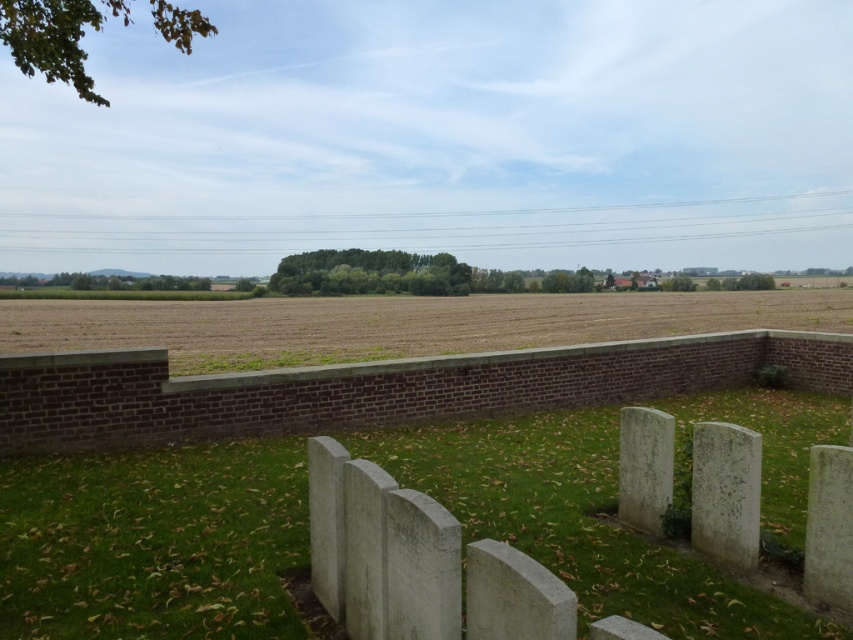
You are a landscape architect designing a new memorial garden. You need to place a 2 meter wide path between the white stone markers at center and the brown grassland at lower center. Can the space accommodate this path?

The white stone markers at center is thinner than brown grassland at lower center. The space between them may be sufficient for a 2 meter wide path, but since the exact distance isn

You are a groundskeeper at the cemetery and need to place a new small flower pot between the white stone gravestone at right and the gray stone gravestone at lower right. Given their sizes, which gravestone will the flower pot be closer to?

The flower pot will be closer to the gray stone gravestone at lower right because the white stone gravestone at right is bigger and likely occupies more space, leaving less room between them.

You are standing on the raised brick platform and want to place a new small flower pot between the white stone gravestone at right and the gray stone gravestone at lower right. Which gravestone should the flower pot be closer to if it needs to be placed near the shorter one?

The white stone gravestone at right is shorter than the gray stone gravestone at lower right, so the flower pot should be placed closer to the white stone gravestone at right.